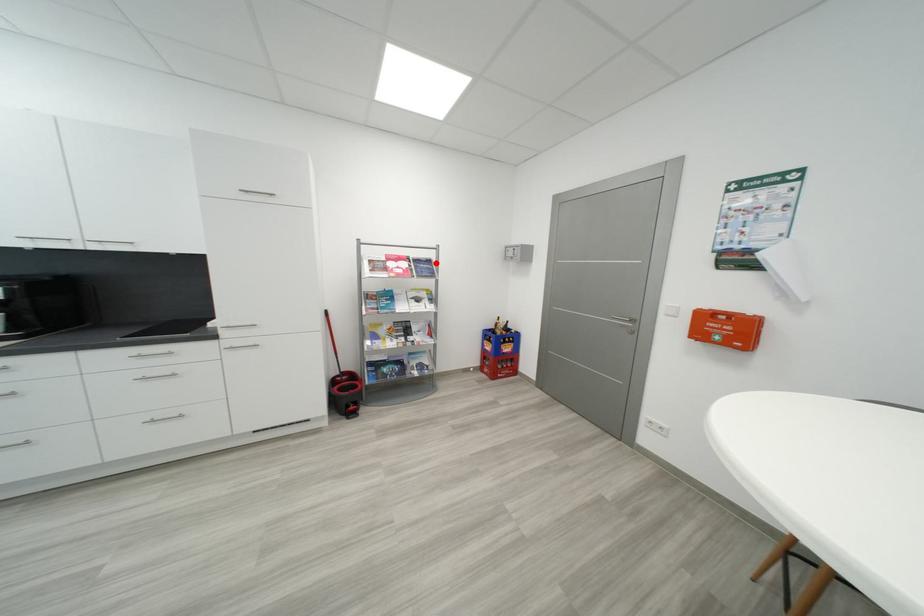
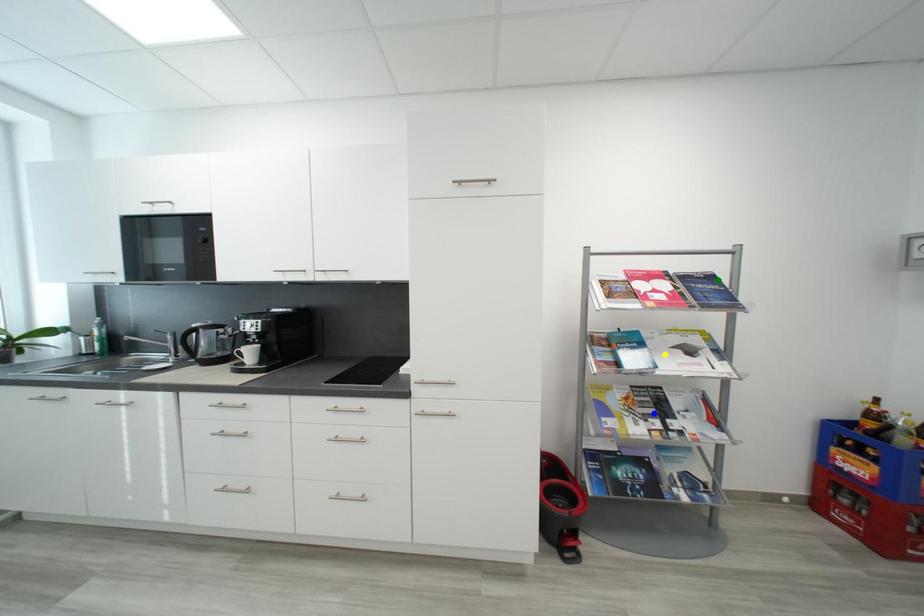
Question: I am providing you with two images of the same scene from different viewpoints. A red point is marked on the first image. You are given multiple points on the second image. Which point in image 2 represents the same 3d spot as the red point in image 1?

Choices:
 (A) yellow point
 (B) green point
 (C) blue point

Answer: (B)